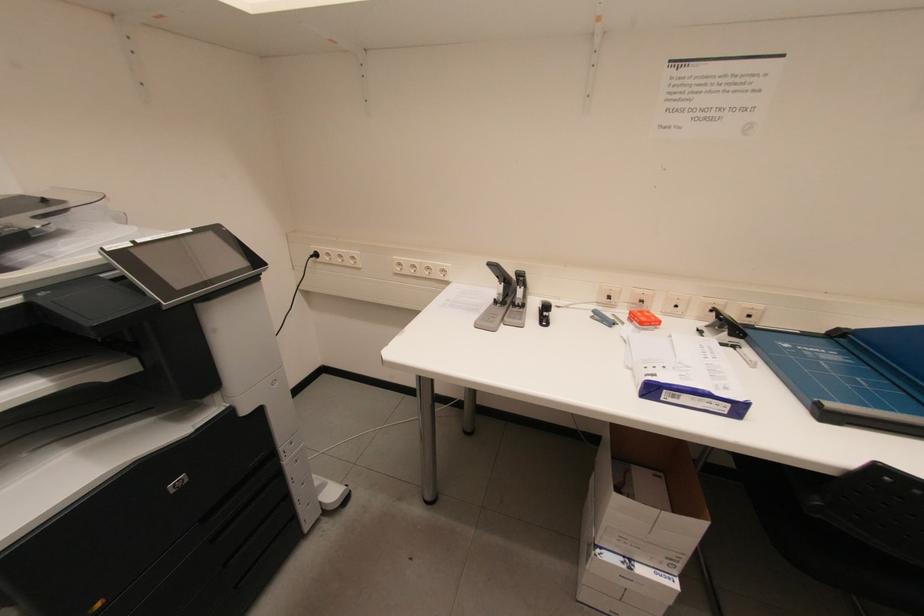
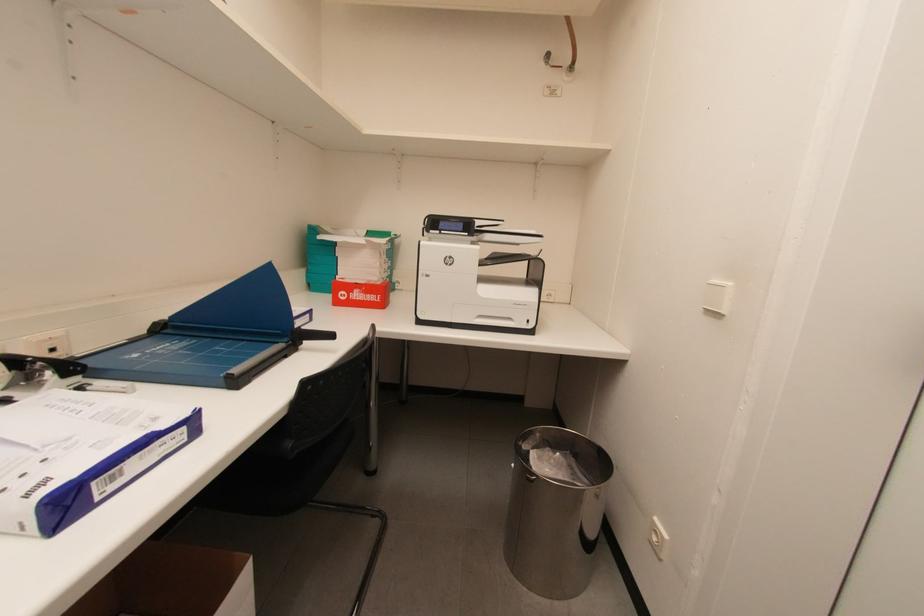
How did the camera likely rotate?

The camera rotated toward right-down.